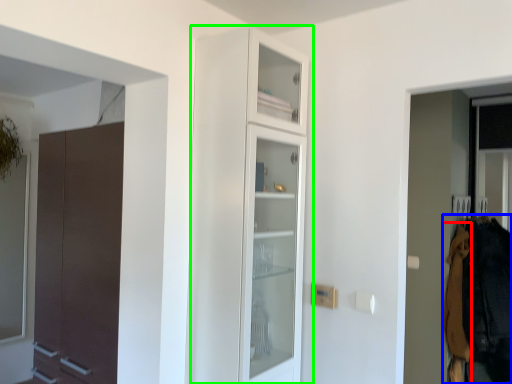
Question: Which object is the farthest from clothing (highlighted by a red box)? Choose among these: clothing (highlighted by a blue box) or cupboard (highlighted by a green box).

Choices:
 (A) clothing
 (B) cupboard

Answer: (B)